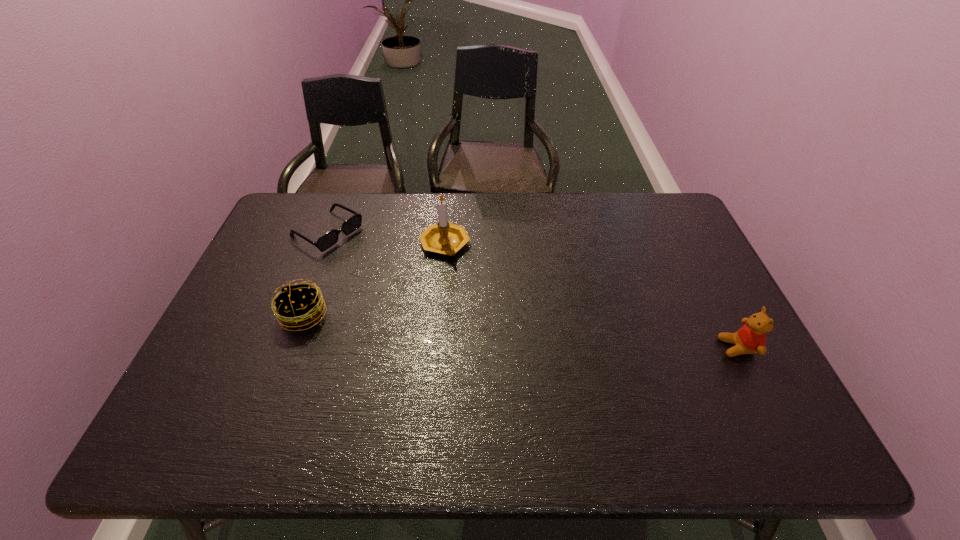
Locate an element on the screen. This screenshot has height=540, width=960. the second shortest object is located at coordinates (298, 306).

This screenshot has height=540, width=960. I want to click on the rightmost object, so click(x=751, y=338).

You are a GUI agent. You are given a task and a screenshot of the screen. Output one action in this format:
    pyautogui.click(x=<x>, y=<y>)
    Task: Click on the teddy bear
    Image resolution: width=960 pixels, height=540 pixels.
    Given the screenshot: What is the action you would take?
    pyautogui.click(x=751, y=338)

At what (x,y) coordinates should I click in order to perform the action: click on candle holder. Please return your answer as a coordinate pair (x, y). Looking at the image, I should click on (446, 238).

Find the location of a particular element. The width and height of the screenshot is (960, 540). the tallest object is located at coordinates (446, 238).

Locate an element on the screen. This screenshot has width=960, height=540. sunglasses is located at coordinates (329, 239).

The height and width of the screenshot is (540, 960). In order to click on free space located on the right of the second shortest object in this screenshot , I will do `click(387, 315)`.

Identify the location of free space located on the front-facing side of the rightmost object. (629, 348).

The height and width of the screenshot is (540, 960). In order to click on blank area located 0.220m on the front-facing side of the rightmost object in this screenshot , I will do `click(633, 348)`.

Find the location of a particular element. The width and height of the screenshot is (960, 540). blank space located 0.090m on the front-facing side of the rightmost object is located at coordinates (684, 348).